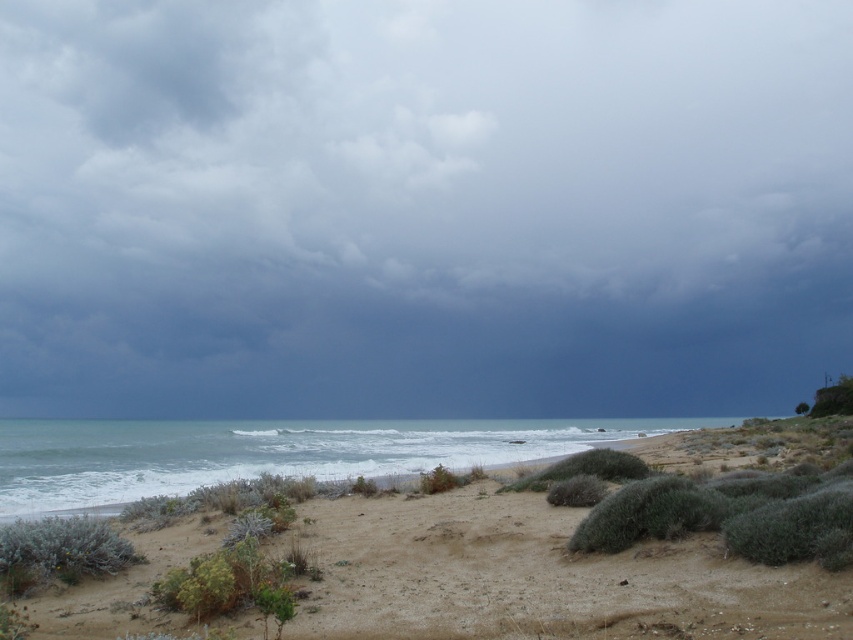
You are a hiker carrying a heavy backpack and need to cross from the green shrub at lower left to the brown sandy beach at lower center. Can you safely walk directly between them without any obstacles?

The distance between the brown sandy beach at lower center and the green shrub at lower left is 2.99 meters, so yes, you can safely walk directly between them without any obstacles as there is enough space.

You are standing on the brown sandy beach at lower center and want to walk to the green shrub at lower left. Which direction should you move to reach it?

You should move to your left because the green shrub at lower left is positioned to the left side of the brown sandy beach at lower center.

You are standing on the beach and want to know which object in the scene is higher when comparing the dark gray cloud at upper center and the blue water at lower left. Can you tell me?

The dark gray cloud at upper center is taller than the blue water at lower left.